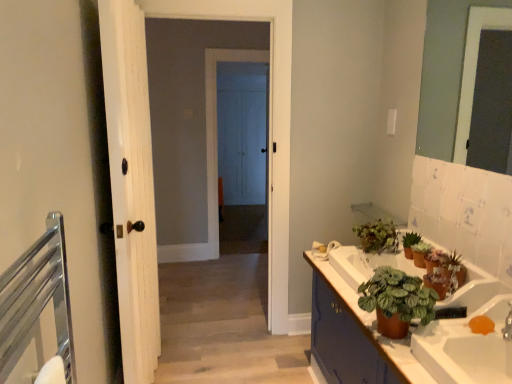
Question: Is brown matte cabinet at lower right to the left of silver metallic faucet at lower right from the viewer's perspective?

Choices:
 (A) no
 (B) yes

Answer: (B)

Question: Is brown matte cabinet at lower right next to silver metallic faucet at lower right and touching it?

Choices:
 (A) no
 (B) yes

Answer: (A)

Question: Considering the relative sizes of brown matte cabinet at lower right and silver metallic faucet at lower right in the image provided, is brown matte cabinet at lower right bigger than silver metallic faucet at lower right?

Choices:
 (A) yes
 (B) no

Answer: (A)

Question: Is brown matte cabinet at lower right shorter than silver metallic faucet at lower right?

Choices:
 (A) no
 (B) yes

Answer: (A)

Question: Is there a large distance between brown matte cabinet at lower right and silver metallic faucet at lower right?

Choices:
 (A) yes
 (B) no

Answer: (B)

Question: From the image's perspective, does brown matte cabinet at lower right appear higher than silver metallic faucet at lower right?

Choices:
 (A) no
 (B) yes

Answer: (A)

Question: Does white wood door at center, the first door in the back-to-front sequence, have a lesser width compared to silver metallic faucet at lower right?

Choices:
 (A) yes
 (B) no

Answer: (A)

Question: Is white wood door at center, the first door in the back-to-front sequence, positioned beyond the bounds of silver metallic faucet at lower right?

Choices:
 (A) yes
 (B) no

Answer: (A)

Question: Does white wood door at center, the first door in the back-to-front sequence, have a smaller size compared to silver metallic faucet at lower right?

Choices:
 (A) no
 (B) yes

Answer: (A)

Question: Can you confirm if white wood door at center, the first door in the back-to-front sequence, is wider than silver metallic faucet at lower right?

Choices:
 (A) no
 (B) yes

Answer: (A)

Question: Would you say white wood door at center, which is the 2th door in front-to-back order, contains silver metallic faucet at lower right?

Choices:
 (A) yes
 (B) no

Answer: (B)

Question: Considering the relative positions of white wood door at center, the first door in the back-to-front sequence, and silver metallic faucet at lower right in the image provided, is white wood door at center, the first door in the back-to-front sequence, behind silver metallic faucet at lower right?

Choices:
 (A) no
 (B) yes

Answer: (B)

Question: Can we say green matte plant at upper right, which ranks as the 3th houseplant in back-to-front order, lies outside clear glass mirror at upper right?

Choices:
 (A) yes
 (B) no

Answer: (A)